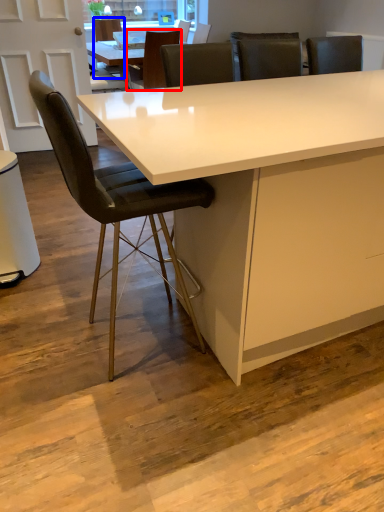
Question: Which object appears farthest to the camera in this image, chair (highlighted by a red box) or chair (highlighted by a blue box)?

Choices:
 (A) chair
 (B) chair

Answer: (B)